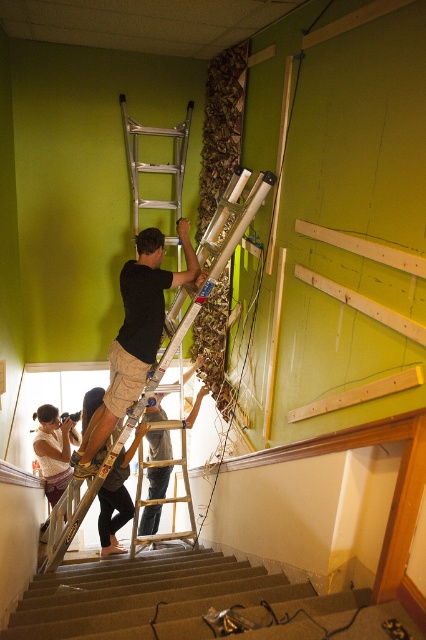
You are standing at the camera position and want to reach the point marked at coordinates (212, 634). The ladder in the scene is 2 meters long. Can you safely climb the ladder to reach that point?

The point marked at coordinates (212, 634) is 2.17 meters away from the camera. Since the ladder is only 2 meters long, it is not long enough to safely reach the point. You would need a ladder at least 2.17 meters in length to safely climb to that point.

You are a painter needing to reach the ceiling. You see a wooden ladder at center and black fabric pants at lower center. Which object can help you reach higher?

The wooden ladder at center is bigger than black fabric pants at lower center, so the wooden ladder at center can help you reach higher.